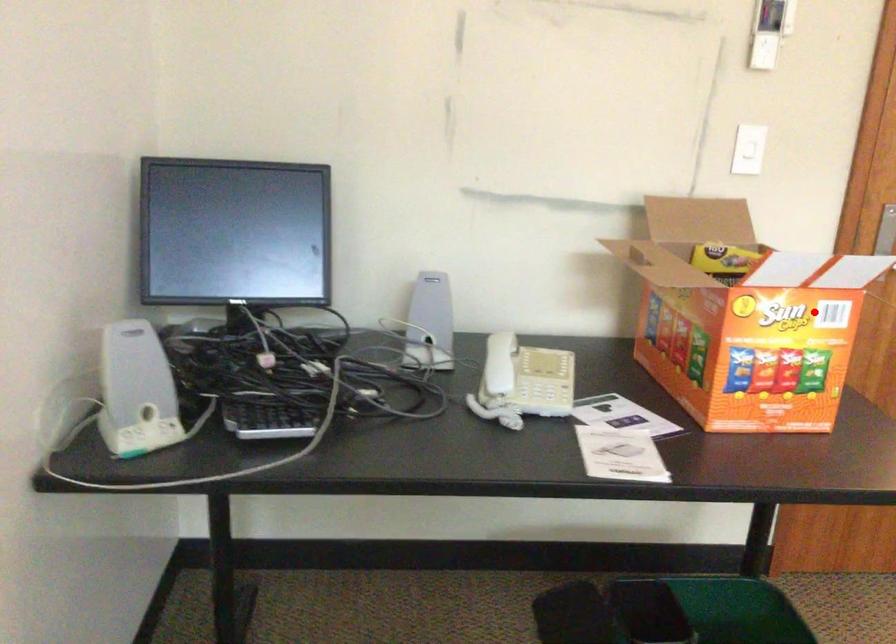
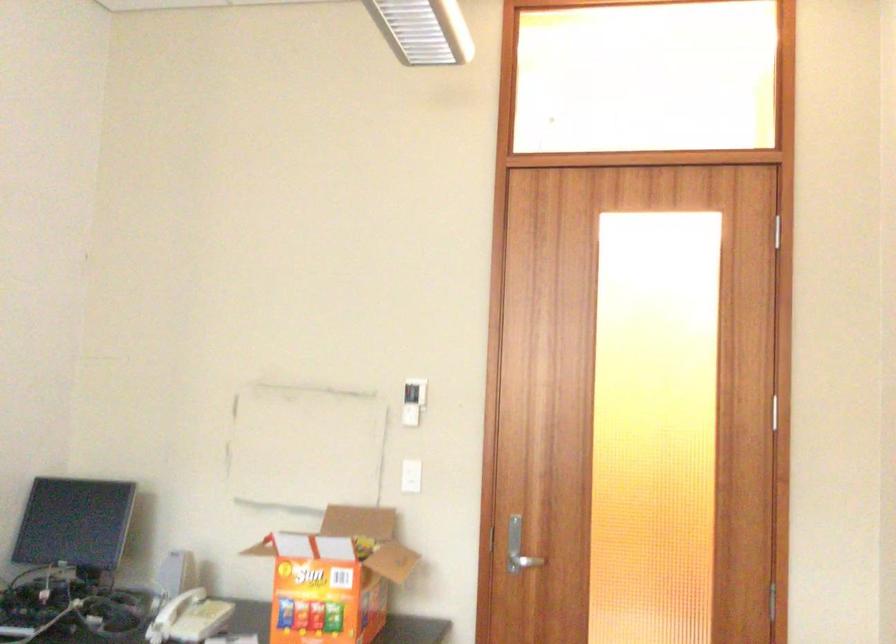
Where in the second image is the point corresponding to the highlighted location from the first image?

(334, 576)